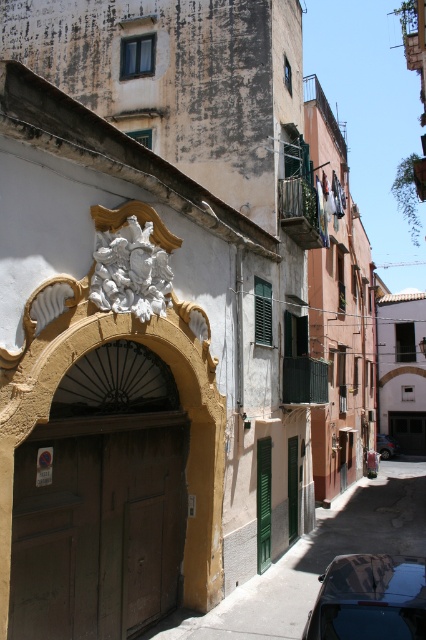
Question: Does shiny black car at lower right have a greater width compared to metallic silver car at center?

Choices:
 (A) no
 (B) yes

Answer: (A)

Question: In this image, where is shiny black car at lower right located relative to metallic silver car at center?

Choices:
 (A) left
 (B) right

Answer: (A)

Question: Does shiny black car at lower right have a larger size compared to metallic silver car at center?

Choices:
 (A) no
 (B) yes

Answer: (A)

Question: Which of the following is the farthest from the observer?

Choices:
 (A) metallic silver car at center
 (B) shiny black car at lower right

Answer: (A)